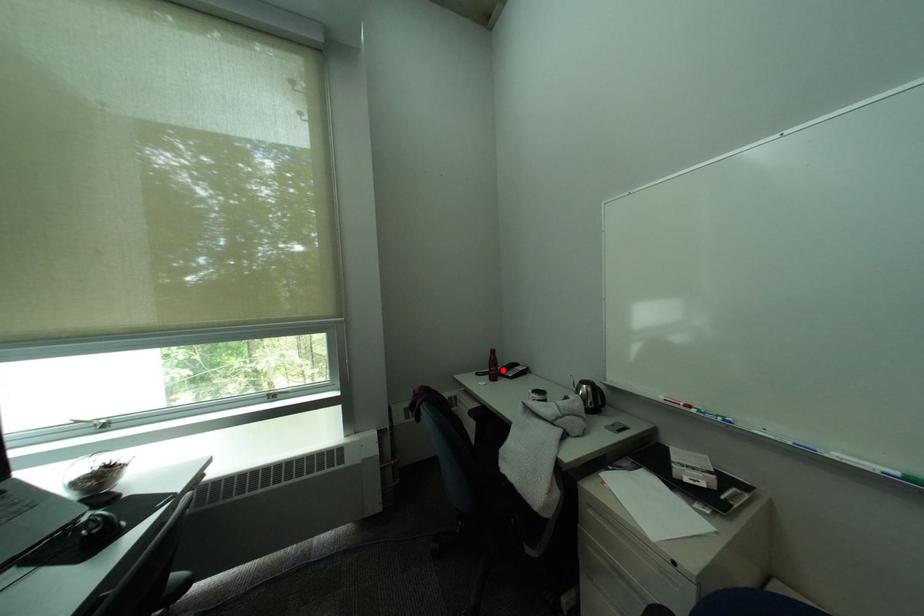
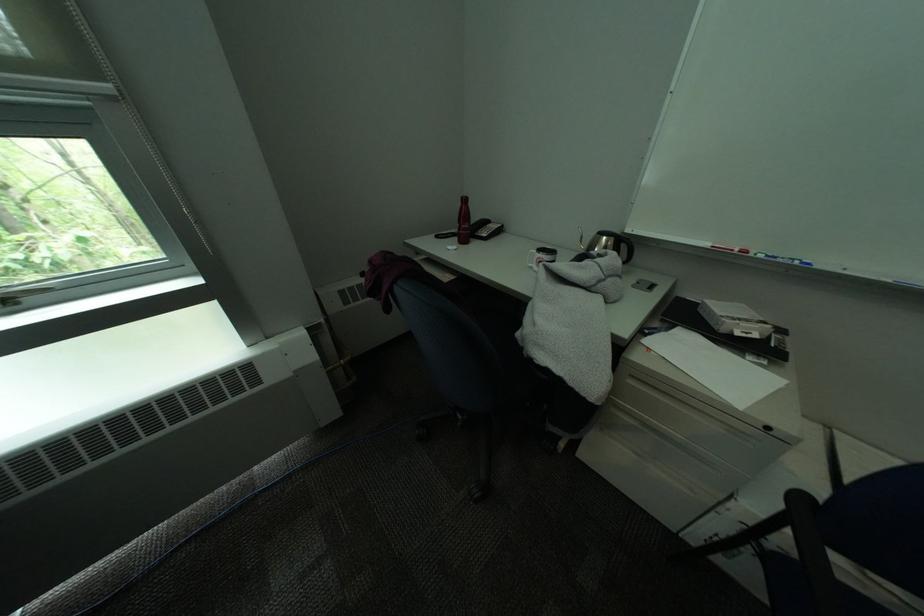
Question: I am providing you with two images of the same scene from different viewpoints. A red point is marked on the first image. Is the red point's position out of view in image 2?

Choices:
 (A) Yes
 (B) No

Answer: (B)